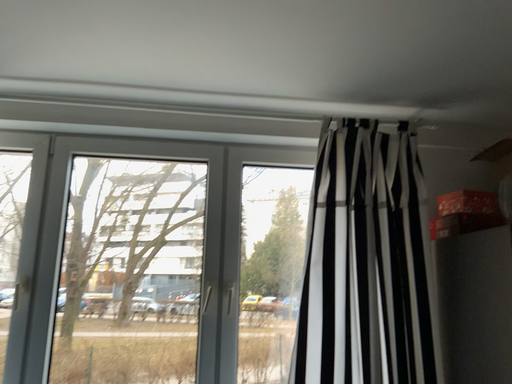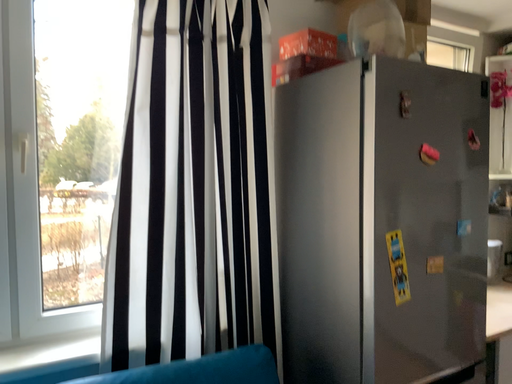
Question: How did the camera likely rotate when shooting the video?

Choices:
 (A) rotated downward
 (B) rotated upward

Answer: (A)